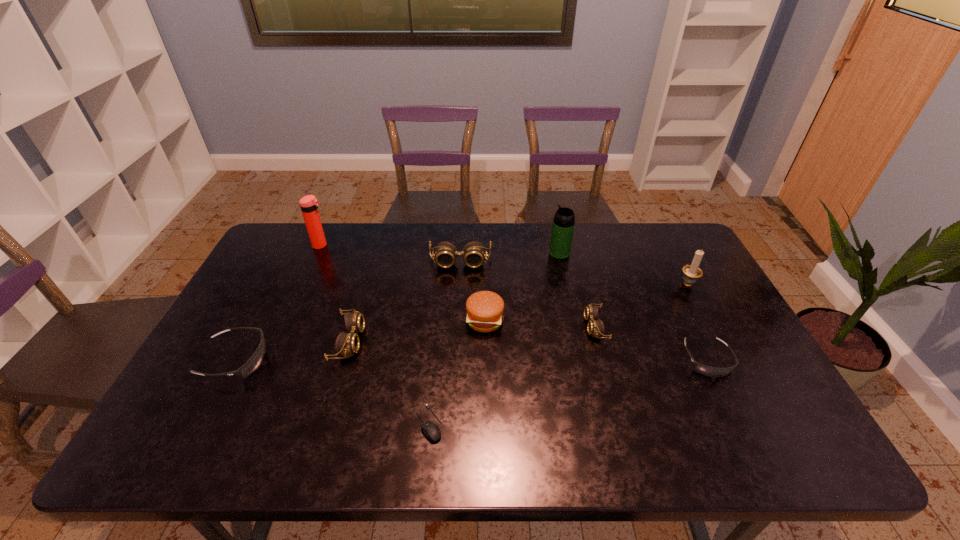
Image resolution: width=960 pixels, height=540 pixels. Identify the location of free space between the hamburger and the green thermos bottle. (522, 287).

I want to click on vacant space in between the left thermos bottle and the second biggest brown goggles, so click(335, 293).

You are a GUI agent. You are given a task and a screenshot of the screen. Output one action in this format:
    pyautogui.click(x=<x>, y=<y>)
    Task: Click on the blank region between the bigger black goggles and the hamburger
    The height and width of the screenshot is (540, 960).
    Given the screenshot: What is the action you would take?
    pyautogui.click(x=360, y=340)

In order to click on free area in between the bigger black goggles and the candle_holder in this screenshot , I will do `click(461, 321)`.

The height and width of the screenshot is (540, 960). In order to click on object identified as the closest to the second goggles from right to left in this screenshot , I will do `click(709, 371)`.

At what (x,y) coordinates should I click in order to perform the action: click on object that ranks as the fourth closest to the fourth farthest object. Please return your answer as a coordinate pair (x, y). Image resolution: width=960 pixels, height=540 pixels. Looking at the image, I should click on (x=484, y=310).

The width and height of the screenshot is (960, 540). Identify the location of the second closest goggles to the left thermos bottle. (473, 253).

The image size is (960, 540). What are the coordinates of `the second closest goggles to the rightmost brown goggles` in the screenshot? It's located at (473, 253).

Find the location of a particular element. This screenshot has width=960, height=540. brown goggles that is the closest to the left thermos bottle is located at coordinates (348, 343).

At what (x,y) coordinates should I click in order to perform the action: click on brown goggles that is the second closest to the left black goggles. Please return your answer as a coordinate pair (x, y). The image size is (960, 540). Looking at the image, I should click on (473, 253).